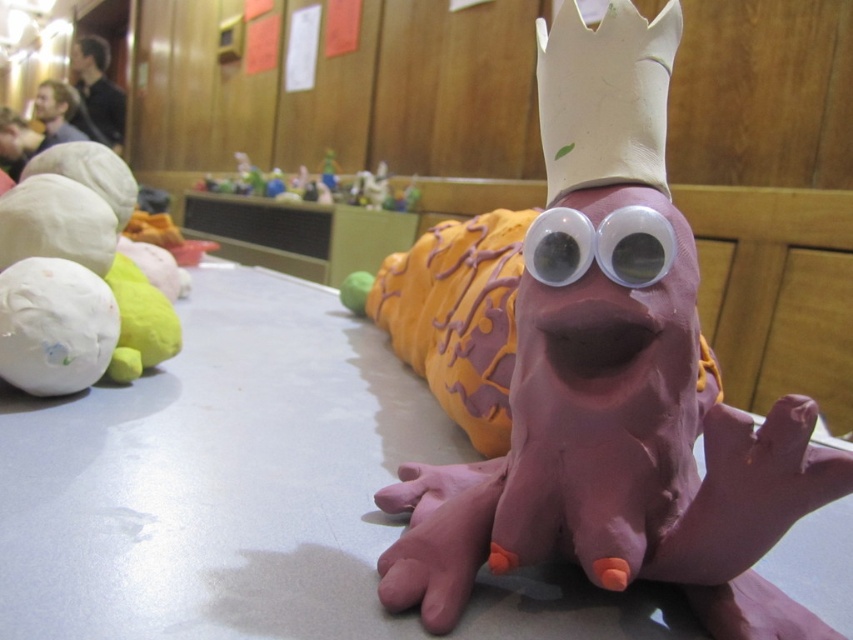
Is pink clay snail at center further to the viewer compared to smooth plastic toys at center?

No, pink clay snail at center is in front of smooth plastic toys at center.

Based on the photo, does pink clay snail at center lie in front of smooth plastic toys at center?

Yes, it is in front of smooth plastic toys at center.

In order to click on pink clay snail at center in this screenshot , I will do `click(614, 387)`.

Does matte gray table at center appear on the right side of blonde hair at upper left?

Correct, you'll find matte gray table at center to the right of blonde hair at upper left.

Can you confirm if matte gray table at center is smaller than blonde hair at upper left?

Actually, matte gray table at center might be larger than blonde hair at upper left.

Is point (364, 573) less distant than point (42, 100)?

That is True.

This screenshot has width=853, height=640. I want to click on matte gray table at center, so click(x=218, y=477).

You are a GUI agent. You are given a task and a screenshot of the screen. Output one action in this format:
    pyautogui.click(x=<x>, y=<y>)
    Task: Click on the matte gray table at center
    
    Given the screenshot: What is the action you would take?
    pyautogui.click(x=218, y=477)

Is matte gray table at center closer to camera compared to smooth plastic toys at center?

Yes.

In the scene shown: Who is more forward, (38, 570) or (234, 176)?

Point (38, 570) is in front.

Identify the location of matte gray table at center. (218, 477).